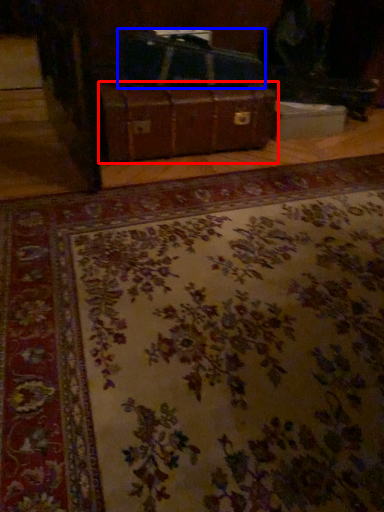
Question: Which point is further to the camera, suitcase (highlighted by a red box) or luggage (highlighted by a blue box)?

Choices:
 (A) suitcase
 (B) luggage

Answer: (B)